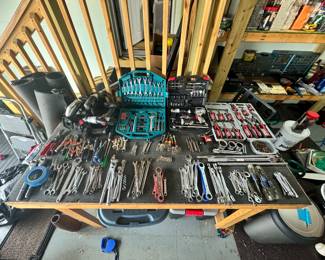
Identify the location of trashcan. (284, 238).